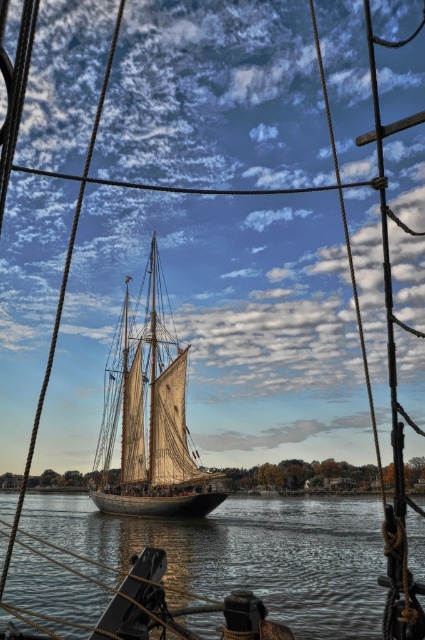
Question: Is clear water at center wider than wooden sailboat at center?

Choices:
 (A) no
 (B) yes

Answer: (B)

Question: Which of the following is the closest to the observer?

Choices:
 (A) clear water at center
 (B) wooden sailboat at center

Answer: (A)

Question: Does clear water at center appear over wooden sailboat at center?

Choices:
 (A) no
 (B) yes

Answer: (A)

Question: Does clear water at center appear on the right side of wooden sailboat at center?

Choices:
 (A) yes
 (B) no

Answer: (A)

Question: Which point is closer to the camera taking this photo?

Choices:
 (A) (150, 300)
 (B) (422, 596)

Answer: (B)